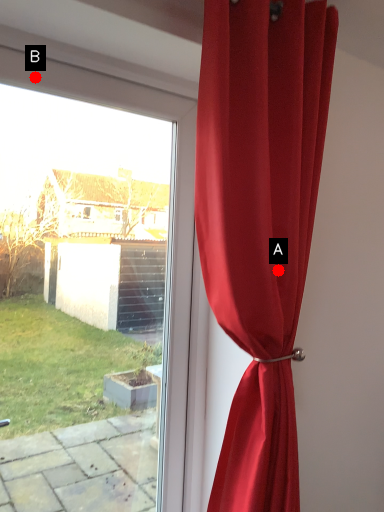
Question: Two points are circled on the image, labeled by A and B beside each circle. Which point appears closest to the camera in this image?

Choices:
 (A) A is closer
 (B) B is closer

Answer: (B)